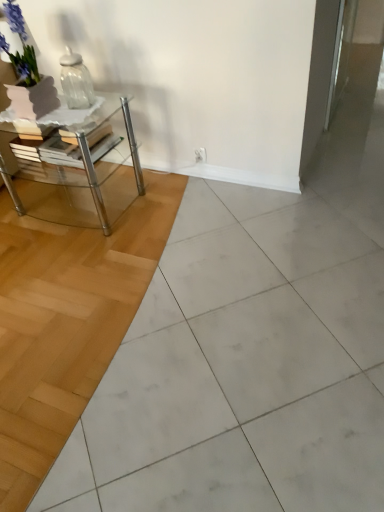
The image size is (384, 512). Identify the location of unoccupied region to the right of clear glass table at left. (181, 202).